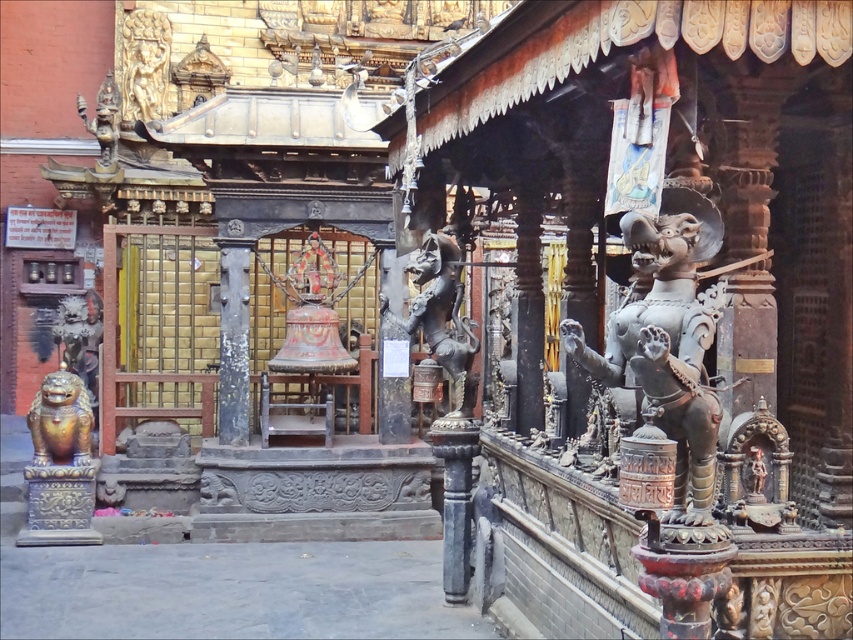
Based on the photo, which is above, polished bronze statue at center or gold polished lion at lower left?

polished bronze statue at center is higher up.

Locate an element on the screen. The width and height of the screenshot is (853, 640). polished bronze statue at center is located at coordinates (440, 316).

The width and height of the screenshot is (853, 640). I want to click on polished bronze statue at center, so click(440, 316).

Is point (666, 390) closer to viewer compared to point (122, 52)?

Yes, point (666, 390) is in front of point (122, 52).

At what (x,y) coordinates should I click in order to perform the action: click on polished bronze statue at right. Please return your answer as a coordinate pair (x, y). Looking at the image, I should click on (666, 340).

Is polished bronze statue at right wider than polished bronze statue at center?

Correct, the width of polished bronze statue at right exceeds that of polished bronze statue at center.

Does polished bronze statue at right have a smaller size compared to polished bronze statue at center?

Incorrect, polished bronze statue at right is not smaller in size than polished bronze statue at center.

Who is more distant from viewer, (672,326) or (432,266)?

Point (432,266)

Find the location of `polished bronze statue at right`. polished bronze statue at right is located at coordinates (666, 340).